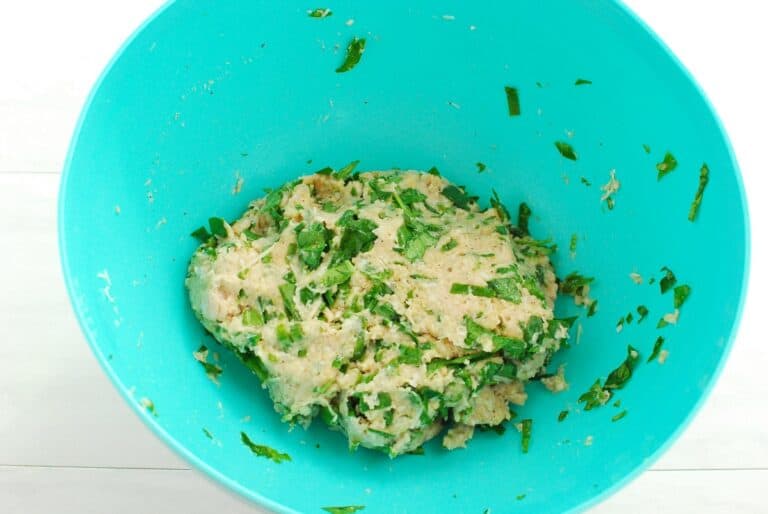
The width and height of the screenshot is (768, 514). Find the location of `inside part of the bowl`. inside part of the bowl is located at coordinates (428, 134).